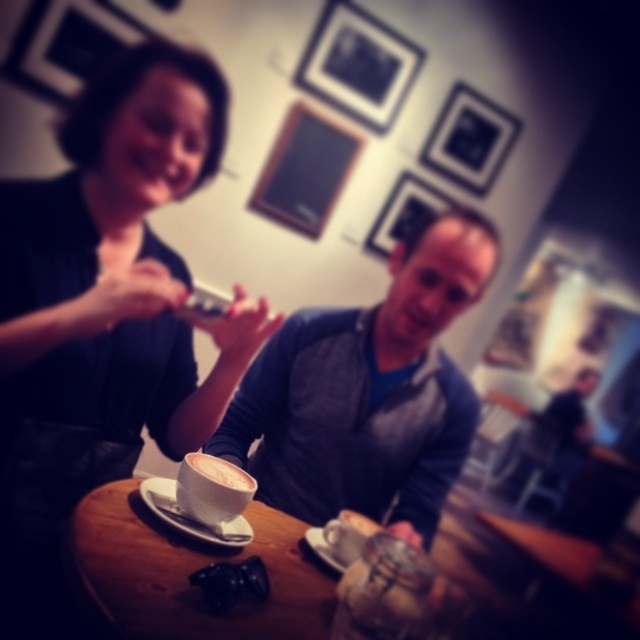
Which is behind, point (154, 256) or point (438, 563)?

The point (438, 563) is more distant.

Between point (72, 188) and point (257, 548), which one is positioned behind?

Point (72, 188)

Image resolution: width=640 pixels, height=640 pixels. Identify the location of matte black coffee cup at upper center. (104, 314).

Is point (150, 490) less distant than point (212, 476)?

No, (150, 490) is behind (212, 476).

Identify the location of white matte saucer at center. The image size is (640, 640). (192, 516).

At what (x,y) coordinates should I click in order to perform the action: click on white matte saucer at center. Please return your answer as a coordinate pair (x, y). The width and height of the screenshot is (640, 640). Looking at the image, I should click on (192, 516).

Find the location of a particular element. wooden table at center is located at coordinates (189, 572).

Is wooden table at center behind white matte saucer at center?

Yes, wooden table at center is further from the viewer.

Does point (467, 493) come closer to viewer compared to point (198, 524)?

No, it is behind (198, 524).

The image size is (640, 640). What are the coordinates of `wooden table at center` in the screenshot? It's located at (189, 572).